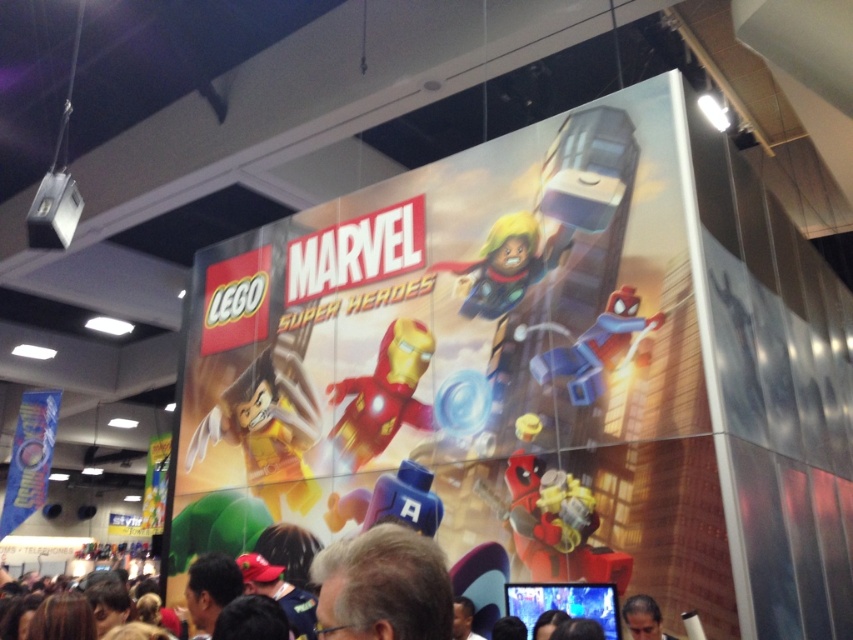
Question: Is shiny blue plastic spider-man at center in front of dark brown hair at upper center?

Choices:
 (A) yes
 (B) no

Answer: (B)

Question: Among these objects, which one is farthest from the camera?

Choices:
 (A) dark brown hair at lower center
 (B) yellow matte figure at lower left
 (C) shiny blue plastic spider-man at center

Answer: (B)

Question: Is yellow matte figure at lower left wider than blue plastic head at center?

Choices:
 (A) yes
 (B) no

Answer: (A)

Question: Which point is closer to the camera taking this photo?

Choices:
 (A) (299, 417)
 (B) (225, 589)

Answer: (B)

Question: Which point is closer to the camera?

Choices:
 (A) blue plastic head at center
 (B) matte red plastic deadpool at center
 (C) shiny blue plastic spider-man at center

Answer: (B)

Question: Does matte red plastic deadpool at center have a larger size compared to gold metallic iron man at center?

Choices:
 (A) yes
 (B) no

Answer: (B)